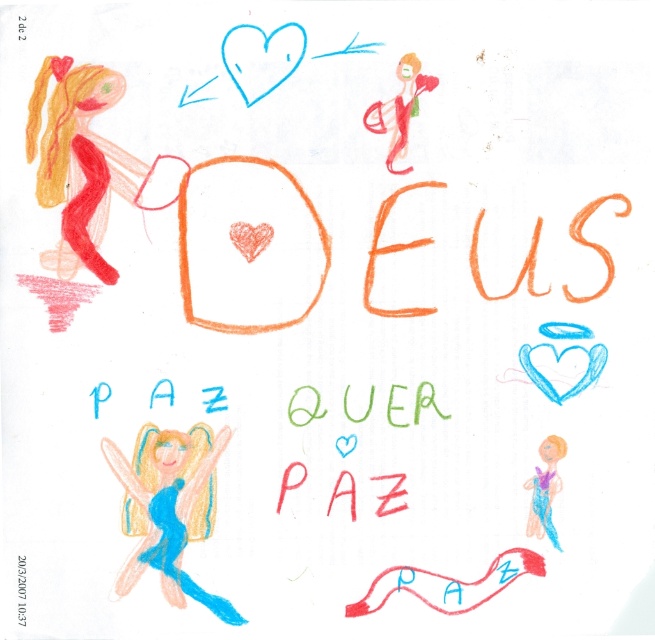
Question: Estimate the real-world distances between objects in this image. Which object is closer to the blue paper fairy at lower left?

Choices:
 (A) pastel purple fabric girl at lower right
 (B) matte red doll at upper right

Answer: (A)

Question: Which point is closer to the camera?

Choices:
 (A) matte red doll at upper right
 (B) pastel purple fabric girl at lower right
 (C) blue paper fairy at lower left

Answer: (C)

Question: Does blue paper fairy at lower left have a larger size compared to matte red doll at upper right?

Choices:
 (A) no
 (B) yes

Answer: (B)

Question: Where is matte red doll at upper right located in relation to pastel purple fabric girl at lower right in the image?

Choices:
 (A) left
 (B) right

Answer: (A)

Question: Does blue paper fairy at lower left have a greater width compared to pastel purple fabric girl at lower right?

Choices:
 (A) no
 (B) yes

Answer: (B)

Question: Which of the following is the farthest from the observer?

Choices:
 (A) pastel purple fabric girl at lower right
 (B) matte red doll at upper right
 (C) blue paper fairy at lower left

Answer: (B)